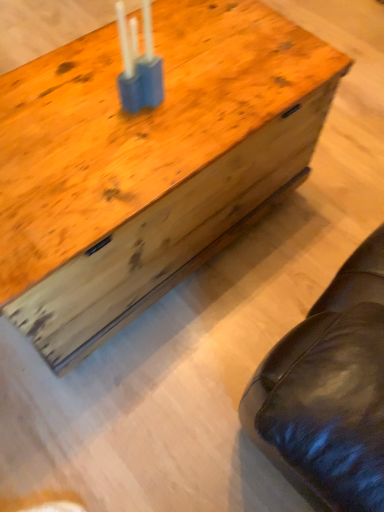
Question: Considering the relative positions of blue plastic candle holder at center and wooden trunk at center in the image provided, is blue plastic candle holder at center to the left of wooden trunk at center from the viewer's perspective?

Choices:
 (A) no
 (B) yes

Answer: (A)

Question: Can you confirm if blue plastic candle holder at center is taller than wooden trunk at center?

Choices:
 (A) yes
 (B) no

Answer: (B)

Question: Can you confirm if blue plastic candle holder at center is wider than wooden trunk at center?

Choices:
 (A) yes
 (B) no

Answer: (B)

Question: Does blue plastic candle holder at center have a smaller size compared to wooden trunk at center?

Choices:
 (A) yes
 (B) no

Answer: (A)

Question: From the image's perspective, is blue plastic candle holder at center on top of wooden trunk at center?

Choices:
 (A) yes
 (B) no

Answer: (A)

Question: From a real-world perspective, is blue plastic candle holder at center beneath wooden trunk at center?

Choices:
 (A) no
 (B) yes

Answer: (A)

Question: Considering the relative positions of wooden trunk at center and blue plastic candle holder at center in the image provided, is wooden trunk at center to the right of blue plastic candle holder at center from the viewer's perspective?

Choices:
 (A) no
 (B) yes

Answer: (A)

Question: From the image's perspective, does wooden trunk at center appear lower than blue plastic candle holder at center?

Choices:
 (A) no
 (B) yes

Answer: (B)

Question: Is wooden trunk at center not inside blue plastic candle holder at center?

Choices:
 (A) yes
 (B) no

Answer: (A)

Question: Considering the relative sizes of wooden trunk at center and blue plastic candle holder at center in the image provided, is wooden trunk at center smaller than blue plastic candle holder at center?

Choices:
 (A) no
 (B) yes

Answer: (A)

Question: Does wooden trunk at center have a greater width compared to blue plastic candle holder at center?

Choices:
 (A) yes
 (B) no

Answer: (A)

Question: Does wooden trunk at center lie in front of blue plastic candle holder at center?

Choices:
 (A) no
 (B) yes

Answer: (B)

Question: From a real-world perspective, is blue plastic candle holder at center above or below wooden trunk at center?

Choices:
 (A) below
 (B) above

Answer: (B)